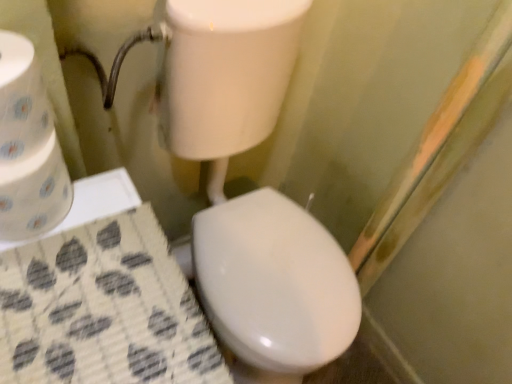
Question: From a real-world perspective, relative to white paper towel at left, positioned as the 1th toilet paper in top-to-bottom order, is white paper towel at left, the second toilet paper in the top-to-bottom sequence, vertically above or below?

Choices:
 (A) below
 (B) above

Answer: (A)

Question: In terms of width, does white paper towel at left, the second toilet paper in the top-to-bottom sequence, look wider or thinner when compared to white paper towel at left, positioned as the 2th toilet paper in bottom-to-top order?

Choices:
 (A) thin
 (B) wide

Answer: (B)

Question: Would you say white paper towel at left, which ranks as the 1th toilet paper in bottom-to-top order, is inside or outside white paper towel at left, positioned as the 2th toilet paper in bottom-to-top order?

Choices:
 (A) outside
 (B) inside

Answer: (A)

Question: Is white paper towel at left, positioned as the 2th toilet paper in bottom-to-top order, inside or outside of white paper towel at left, which ranks as the 1th toilet paper in bottom-to-top order?

Choices:
 (A) inside
 (B) outside

Answer: (B)

Question: Would you say white paper towel at left, positioned as the 1th toilet paper in top-to-bottom order, is to the left or to the right of white paper towel at left, the second toilet paper in the top-to-bottom sequence, in the picture?

Choices:
 (A) right
 (B) left

Answer: (A)

Question: Is white paper towel at left, positioned as the 2th toilet paper in bottom-to-top order, wider or thinner than white paper towel at left, which ranks as the 1th toilet paper in bottom-to-top order?

Choices:
 (A) thin
 (B) wide

Answer: (A)

Question: Based on their sizes in the image, would you say white paper towel at left, positioned as the 1th toilet paper in top-to-bottom order, is bigger or smaller than white paper towel at left, which ranks as the 1th toilet paper in bottom-to-top order?

Choices:
 (A) small
 (B) big

Answer: (A)